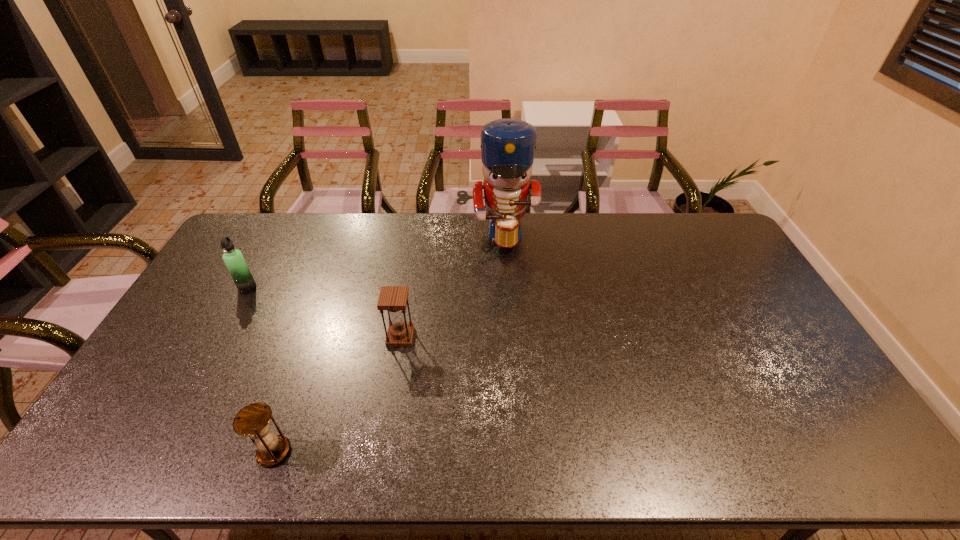
Where is `the second closest object relative to the tallest object`? The height and width of the screenshot is (540, 960). the second closest object relative to the tallest object is located at coordinates (233, 258).

I want to click on object that is the second closest to the second tallest object, so click(253, 420).